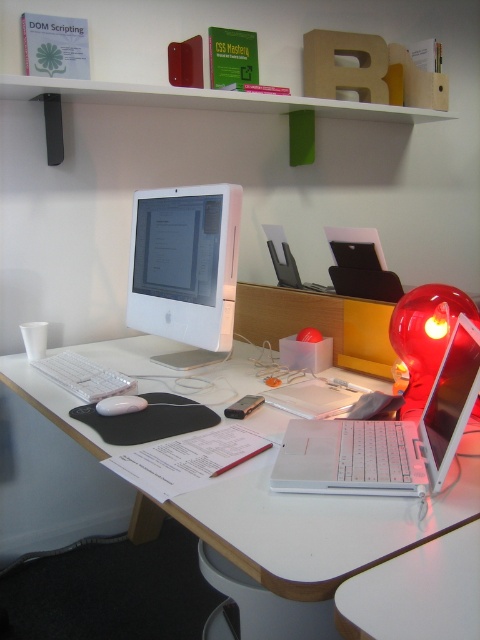
Question: Which point is closer to the camera?

Choices:
 (A) (124, 401)
 (B) (192, 208)

Answer: (A)

Question: Estimate the real-world distances between objects in this image. Which object is farther from the white glossy computer monitor at center?

Choices:
 (A) white glossy table at center
 (B) white plastic keyboard at center
 (C) white matte mouse at center
 (D) white plastic laptop at right

Answer: (D)

Question: Does white plastic laptop at right lie behind white plastic keyboard at center?

Choices:
 (A) no
 (B) yes

Answer: (A)

Question: Among these points, which one is farthest from the camera?

Choices:
 (A) (99, 403)
 (B) (322, 465)
 (C) (276, 429)
 (D) (96, 381)

Answer: (D)

Question: Is white glossy table at center thinner than white glossy computer monitor at center?

Choices:
 (A) no
 (B) yes

Answer: (A)

Question: From the image, what is the correct spatial relationship of white glossy computer monitor at center in relation to white matte mouse at center?

Choices:
 (A) above
 (B) below

Answer: (A)